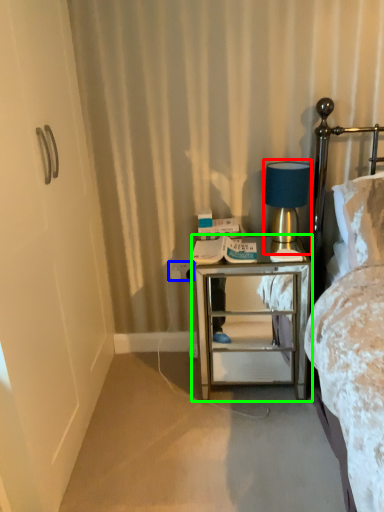
Question: Which object is the closest to the table lamp (highlighted by a red box)? Choose among these: electric outlet (highlighted by a blue box) or nightstand (highlighted by a green box).

Choices:
 (A) electric outlet
 (B) nightstand

Answer: (B)